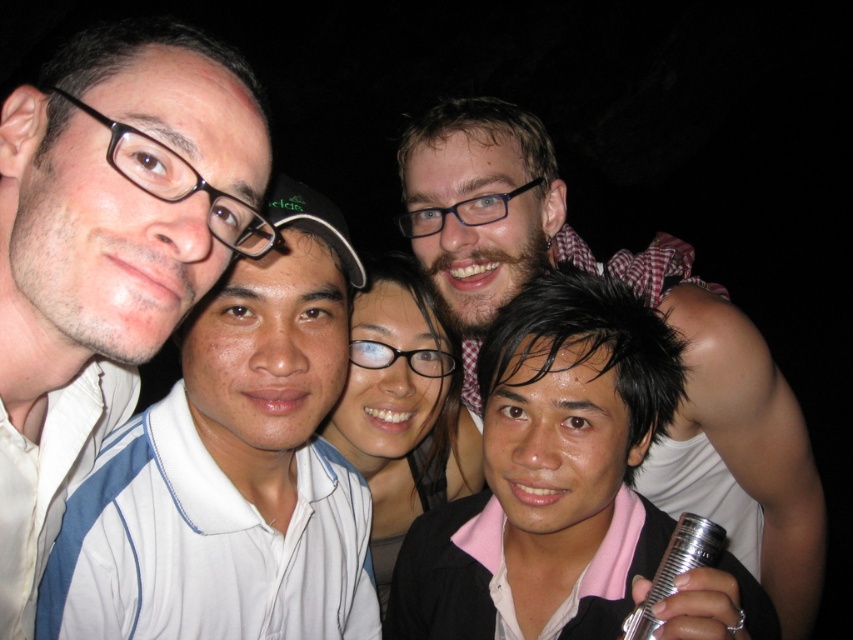
Consider the image. Which is more to the right, matte white shirt at left or bearded man at center?

bearded man at center

Is matte white shirt at left to the right of bearded man at center from the viewer's perspective?

In fact, matte white shirt at left is to the left of bearded man at center.

The width and height of the screenshot is (853, 640). What do you see at coordinates (107, 252) in the screenshot?
I see `matte white shirt at left` at bounding box center [107, 252].

Find the location of a particular element. The image size is (853, 640). matte white shirt at left is located at coordinates (107, 252).